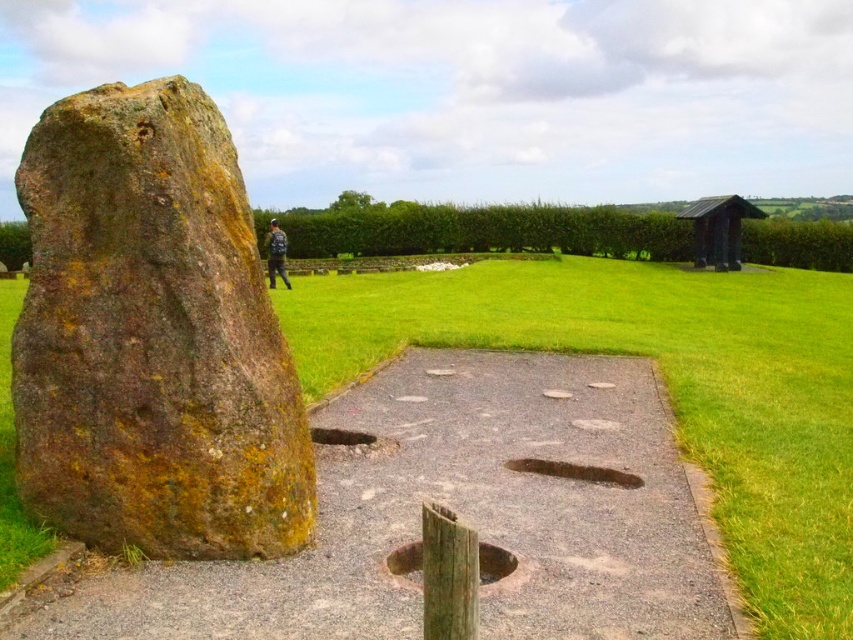
Question: Can you confirm if rusty stone boulder at left is thinner than brown rough stone at center?

Choices:
 (A) yes
 (B) no

Answer: (B)

Question: Does brown rough hole at center appear on the left side of brown rough stone at center?

Choices:
 (A) no
 (B) yes

Answer: (B)

Question: Which point is closer to the camera?

Choices:
 (A) brown rough hole at center
 (B) rusty stone boulder at left

Answer: (B)

Question: Among these objects, which one is nearest to the camera?

Choices:
 (A) gray gravel path at center
 (B) rusty stone boulder at left
 (C) brown rough hole at center

Answer: (A)

Question: Among these objects, which one is nearest to the camera?

Choices:
 (A) blue fabric jacket at upper center
 (B) gray gravel path at center
 (C) rusty stone boulder at left
 (D) brown stone hole at center

Answer: (B)

Question: Can you confirm if rusty stone boulder at left is smaller than brown rough stone at center?

Choices:
 (A) yes
 (B) no

Answer: (B)